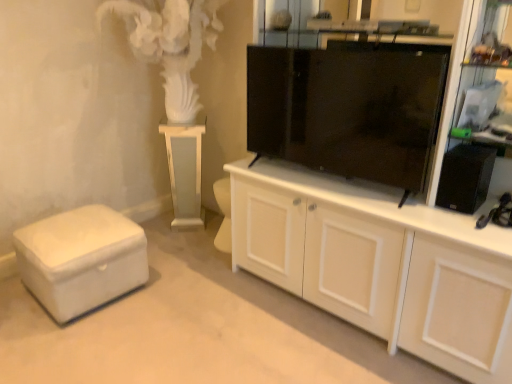
What is the approximate height of black glossy tv cabinet at center?

black glossy tv cabinet at center is 25.08 inches in height.

Image resolution: width=512 pixels, height=384 pixels. Describe the element at coordinates (349, 108) in the screenshot. I see `black glossy tv cabinet at center` at that location.

What is the approximate height of black plastic speaker at right?

black plastic speaker at right is 9.75 inches in height.

The height and width of the screenshot is (384, 512). Find the location of `white wood cabinet at center`. white wood cabinet at center is located at coordinates pos(388,266).

In order to face white glossy pedestal at center, should I rotate leftwards or rightwards?

To face it directly, rotate left by 8.890 degrees.

This screenshot has width=512, height=384. What are the coordinates of `white leather ottoman at lower left` in the screenshot? It's located at (81, 259).

Considering the positions of objects white leather ottoman at lower left and black glossy tv cabinet at center in the image provided, who is in front, white leather ottoman at lower left or black glossy tv cabinet at center?

black glossy tv cabinet at center is more forward.

From the picture: Is white leather ottoman at lower left turned away from black glossy tv cabinet at center?

No, white leather ottoman at lower left's orientation is not away from black glossy tv cabinet at center.

Is white leather ottoman at lower left smaller than black glossy tv cabinet at center?

No.

Considering the relative positions of white leather ottoman at lower left and black glossy tv cabinet at center in the image provided, is white leather ottoman at lower left to the right of black glossy tv cabinet at center from the viewer's perspective?

Incorrect, white leather ottoman at lower left is not on the right side of black glossy tv cabinet at center.

Looking at their sizes, would you say black glossy tv cabinet at center is wider or thinner than white leather ottoman at lower left?

Considering their sizes, black glossy tv cabinet at center looks slimmer than white leather ottoman at lower left.

Can you confirm if black glossy tv cabinet at center is smaller than white leather ottoman at lower left?

Yes, black glossy tv cabinet at center is smaller than white leather ottoman at lower left.

Is point (340, 68) behind point (37, 253)?

That is False.

What's the angular difference between black glossy tv cabinet at center and white leather ottoman at lower left's facing directions?

84.9 degrees.

Is white glossy pedestal at center positioned behind white wood cabinet at center?

Yes, the depth of white glossy pedestal at center is greater than that of white wood cabinet at center.

Is white glossy pedestal at center facing away from white wood cabinet at center?

No, white glossy pedestal at center's orientation is not away from white wood cabinet at center.

From a real-world perspective, which is physically above, white glossy pedestal at center or white wood cabinet at center?

white wood cabinet at center is physically above.

Is point (443, 159) in front of point (326, 79)?

Yes, point (443, 159) is in front of point (326, 79).

Is black plastic speaker at right thinner than black glossy tv cabinet at center?

No.

From the image's perspective, which is above, black plastic speaker at right or black glossy tv cabinet at center?

black glossy tv cabinet at center is shown above in the image.

Is white leather ottoman at lower left far from black plastic speaker at right?

Absolutely, white leather ottoman at lower left is distant from black plastic speaker at right.

How different are the orientations of white leather ottoman at lower left and black plastic speaker at right in degrees?

The facing directions of white leather ottoman at lower left and black plastic speaker at right are 88.3 degrees apart.

From the picture: From a real-world perspective, is white leather ottoman at lower left under black plastic speaker at right?

Yes, from a real-world perspective, white leather ottoman at lower left is below black plastic speaker at right.

Does point (104, 228) lie behind point (464, 167)?

Yes.

Based on the photo, looking at the image, does black plastic speaker at right seem bigger or smaller compared to white glossy pedestal at center?

Considering their sizes, black plastic speaker at right takes up less space than white glossy pedestal at center.

Consider the image. Is black plastic speaker at right with white glossy pedestal at center?

No, black plastic speaker at right is not touching white glossy pedestal at center.

Which is in front, point (448, 197) or point (199, 127)?

Point (448, 197)

From the image's perspective, which one is positioned higher, white glossy pedestal at center or white leather ottoman at lower left?

white glossy pedestal at center.

Based on the photo, considering their positions, is white glossy pedestal at center located in front of or behind white leather ottoman at lower left?

Visually, white glossy pedestal at center is located behind white leather ottoman at lower left.

From a real-world perspective, is white glossy pedestal at center below white leather ottoman at lower left?

Actually, white glossy pedestal at center is physically above white leather ottoman at lower left in the real world.

Locate an element on the screen. This screenshot has height=384, width=512. tv cabinet lying above the white leather ottoman at lower left (from the image's perspective) is located at coordinates (349, 108).

In the image, there is a black glossy tv cabinet at center. In order to click on furniture below it (from the image's perspective) in this screenshot , I will do `click(81, 259)`.

Considering their positions, is black glossy tv cabinet at center positioned further to black plastic speaker at right than white wood cabinet at center?

black glossy tv cabinet at center is further to black plastic speaker at right.

Based on their spatial positions, is white glossy pedestal at center or black glossy tv cabinet at center further from white wood cabinet at center?

white glossy pedestal at center is further to white wood cabinet at center.

Looking at the image, which one is located closer to white glossy pedestal at center, white wood cabinet at center or white leather ottoman at lower left?

Among the two, white leather ottoman at lower left is located nearer to white glossy pedestal at center.

Considering their positions, is white wood cabinet at center positioned further to black glossy tv cabinet at center than white leather ottoman at lower left?

Among the two, white leather ottoman at lower left is located further to black glossy tv cabinet at center.

When comparing their distances from black glossy tv cabinet at center, does black plastic speaker at right or white wood cabinet at center seem closer?

The object closer to black glossy tv cabinet at center is white wood cabinet at center.

Based on their spatial positions, is white wood cabinet at center or white glossy pedestal at center further from black glossy tv cabinet at center?

white glossy pedestal at center is positioned further to the anchor black glossy tv cabinet at center.

Based on the photo, which object lies further to the anchor point white leather ottoman at lower left, white glossy pedestal at center or white wood cabinet at center?

The object further to white leather ottoman at lower left is white wood cabinet at center.

From the image, which object appears to be nearer to white leather ottoman at lower left, black glossy tv cabinet at center or white wood cabinet at center?

The object closer to white leather ottoman at lower left is white wood cabinet at center.

Where is `tv cabinet situated between white leather ottoman at lower left and black plastic speaker at right from left to right`? Image resolution: width=512 pixels, height=384 pixels. tv cabinet situated between white leather ottoman at lower left and black plastic speaker at right from left to right is located at coordinates (349, 108).

The image size is (512, 384). Identify the location of cabinetry between white leather ottoman at lower left and black plastic speaker at right. (x=388, y=266).

The width and height of the screenshot is (512, 384). I want to click on table located between white leather ottoman at lower left and black glossy tv cabinet at center in the left-right direction, so click(185, 171).

Where is `tv cabinet located between white leather ottoman at lower left and white wood cabinet at center in the left-right direction`? tv cabinet located between white leather ottoman at lower left and white wood cabinet at center in the left-right direction is located at coordinates [x=349, y=108].